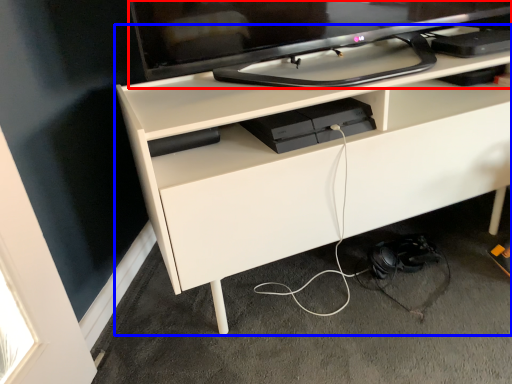
Question: Which of the following is the farthest to the observer, television (highlighted by a red box) or desk (highlighted by a blue box)?

Choices:
 (A) television
 (B) desk

Answer: (B)